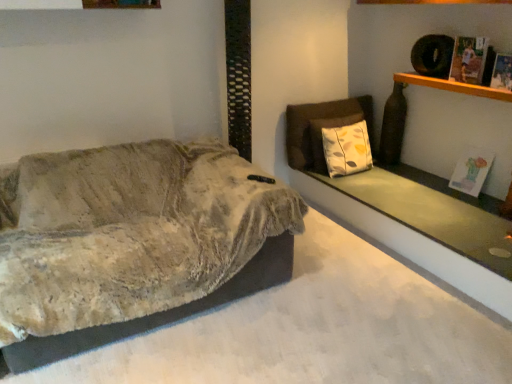
The height and width of the screenshot is (384, 512). I want to click on vacant point to the right of textured beige blanket at left, so click(351, 303).